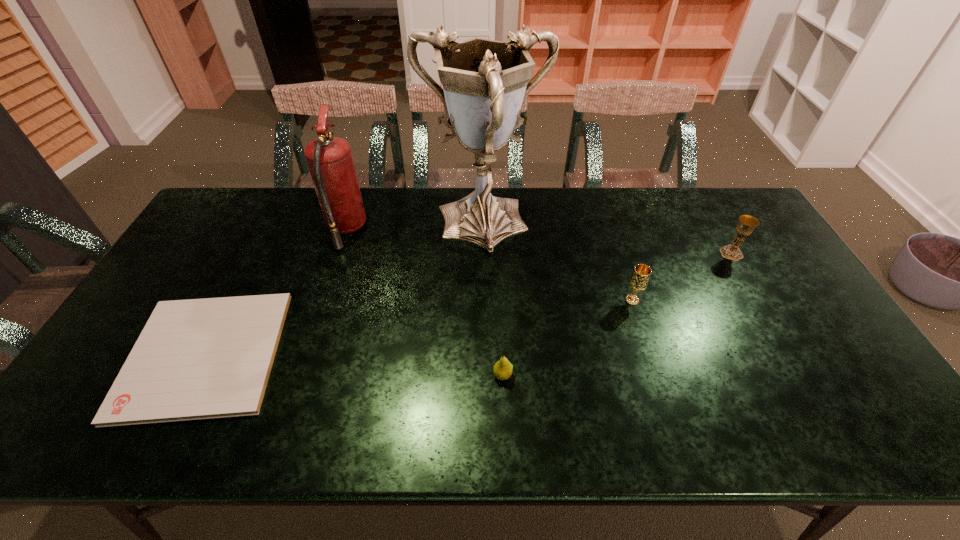
This screenshot has width=960, height=540. Identify the location of vacant area situated on the left of the right chalice. (684, 253).

I want to click on vacant space located on the right of the left chalice, so click(x=697, y=300).

This screenshot has height=540, width=960. Identify the location of free location located 0.180m on the left of the fifth tallest object. (420, 375).

The height and width of the screenshot is (540, 960). I want to click on vacant space situated on the back of the clipboard, so click(x=260, y=248).

Where is `trophy cup located at the far edge`? The image size is (960, 540). trophy cup located at the far edge is located at coordinates (484, 81).

Locate an element on the screen. The width and height of the screenshot is (960, 540). fire extinguisher present at the far edge is located at coordinates (329, 159).

Where is `object present at the near edge`? The image size is (960, 540). object present at the near edge is located at coordinates (207, 358).

Find the location of `object located at the left edge`. object located at the left edge is located at coordinates (207, 358).

Where is `object that is at the right edge`? This screenshot has width=960, height=540. object that is at the right edge is located at coordinates (747, 224).

This screenshot has width=960, height=540. What are the coordinates of `object that is at the near left corner` in the screenshot? It's located at pos(207,358).